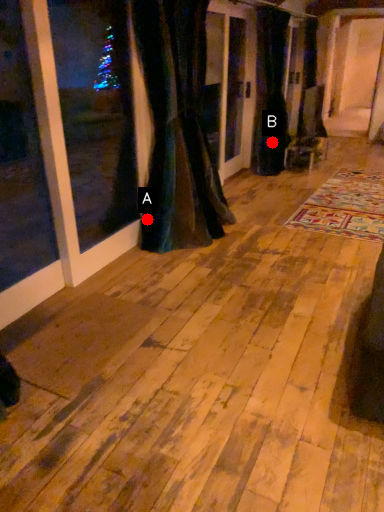
Question: Two points are circled on the image, labeled by A and B beside each circle. Which point is farther from the camera taking this photo?

Choices:
 (A) A is further
 (B) B is further

Answer: (B)